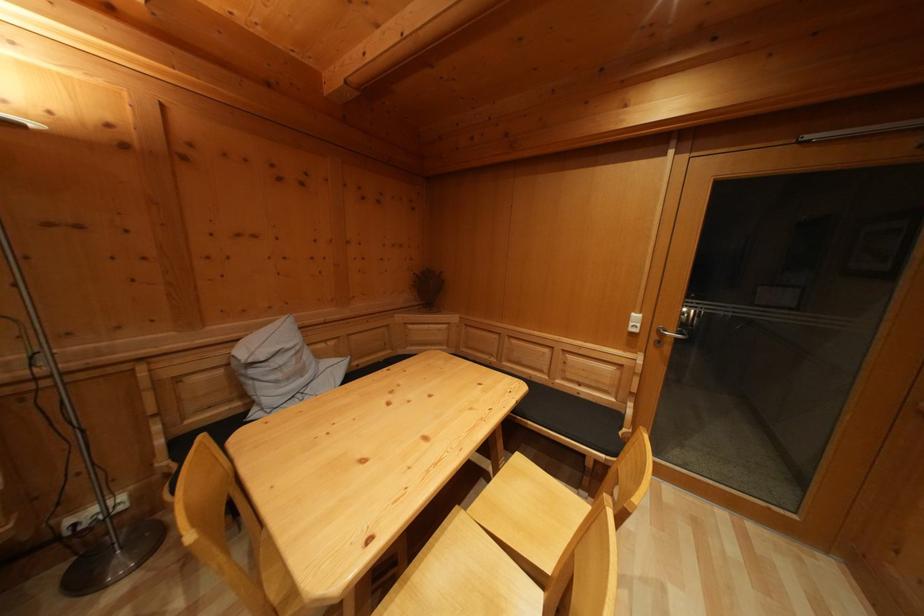
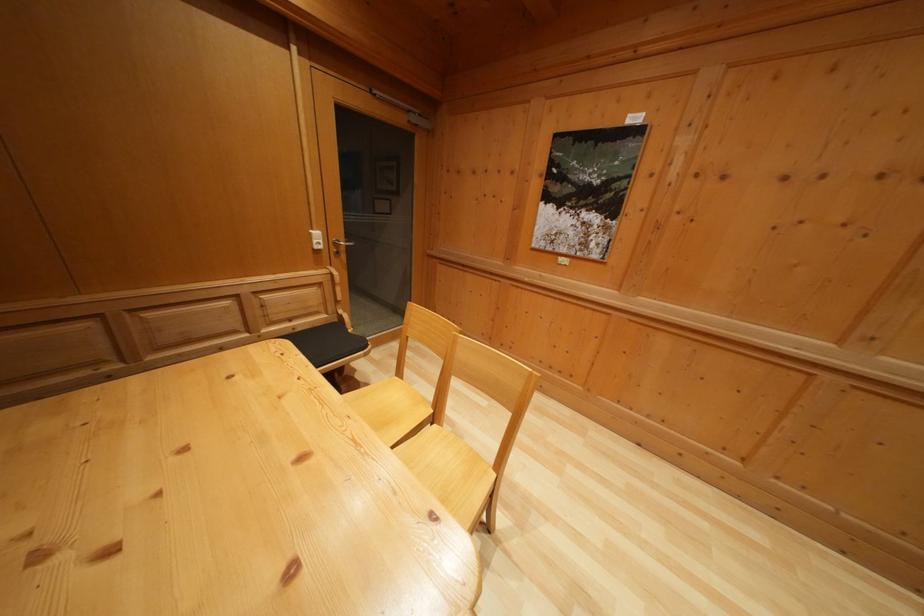
Locate, in the second image, the point that corresponds to pixel 642 323 in the first image.

(322, 240)